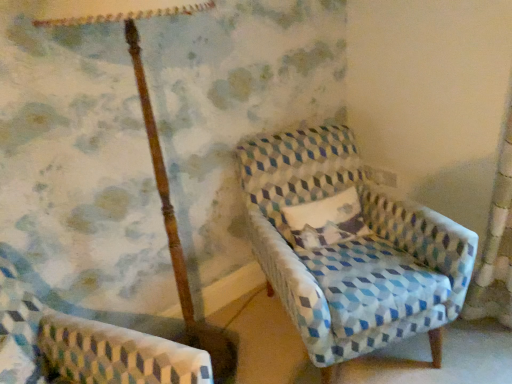
Question: Considering the relative sizes of wooden pole at upper left and textured cream pillow at center in the image provided, is wooden pole at upper left wider than textured cream pillow at center?

Choices:
 (A) no
 (B) yes

Answer: (B)

Question: Is wooden pole at upper left to the left of textured cream pillow at center from the viewer's perspective?

Choices:
 (A) no
 (B) yes

Answer: (B)

Question: Would you say wooden pole at upper left is outside textured cream pillow at center?

Choices:
 (A) yes
 (B) no

Answer: (A)

Question: Is wooden pole at upper left facing towards textured cream pillow at center?

Choices:
 (A) no
 (B) yes

Answer: (A)

Question: From a real-world perspective, is wooden pole at upper left located higher than textured cream pillow at center?

Choices:
 (A) yes
 (B) no

Answer: (A)

Question: Does wooden pole at upper left have a lesser width compared to textured cream pillow at center?

Choices:
 (A) no
 (B) yes

Answer: (A)

Question: Is patterned fabric armchair at lower left, marked as the second chair in a right-to-left arrangement, taller than textured blue and white armchair at center, which is counted as the second chair, starting from the left?

Choices:
 (A) no
 (B) yes

Answer: (A)

Question: Considering the relative sizes of patterned fabric armchair at lower left, marked as the second chair in a right-to-left arrangement, and textured blue and white armchair at center, which is counted as the second chair, starting from the left, in the image provided, is patterned fabric armchair at lower left, marked as the second chair in a right-to-left arrangement, wider than textured blue and white armchair at center, which is counted as the second chair, starting from the left,?

Choices:
 (A) yes
 (B) no

Answer: (A)

Question: From a real-world perspective, is patterned fabric armchair at lower left, marked as the second chair in a right-to-left arrangement, positioned under textured blue and white armchair at center, which is counted as the second chair, starting from the left, based on gravity?

Choices:
 (A) no
 (B) yes

Answer: (A)

Question: Can you confirm if patterned fabric armchair at lower left, marked as the second chair in a right-to-left arrangement, is positioned to the left of textured blue and white armchair at center, which is the 1th chair from right to left?

Choices:
 (A) no
 (B) yes

Answer: (B)

Question: From a real-world perspective, is patterned fabric armchair at lower left, which appears as the first chair when viewed from the left, physically above textured blue and white armchair at center, which is the 1th chair from right to left?

Choices:
 (A) yes
 (B) no

Answer: (A)

Question: Is patterned fabric armchair at lower left, marked as the second chair in a right-to-left arrangement, positioned with its back to textured blue and white armchair at center, which is counted as the second chair, starting from the left?

Choices:
 (A) no
 (B) yes

Answer: (A)

Question: From a real-world perspective, is patterned fabric armchair at lower left, marked as the second chair in a right-to-left arrangement, under wooden pole at upper left?

Choices:
 (A) yes
 (B) no

Answer: (A)